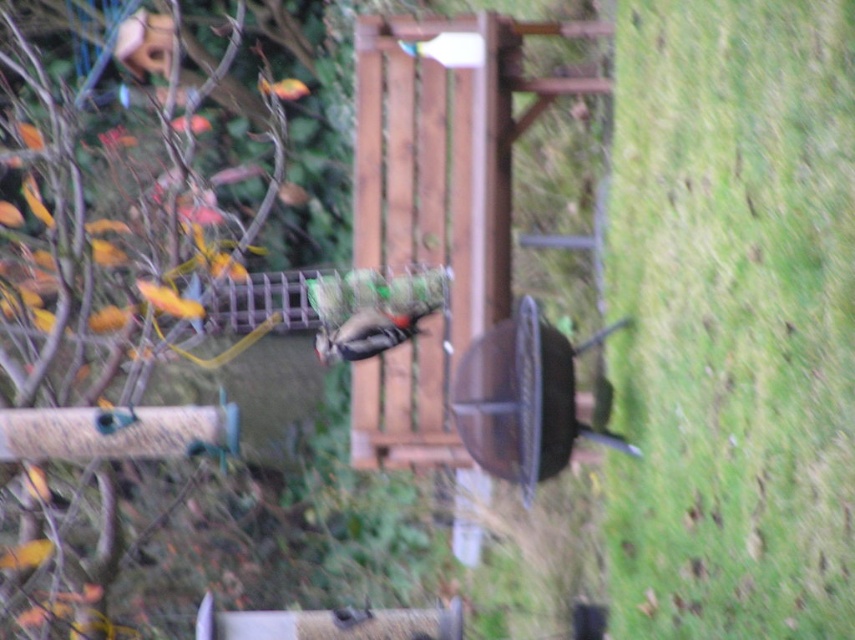
Can you confirm if green grass at lower right is positioned above brown matte woodpecker at center?

Correct, green grass at lower right is located above brown matte woodpecker at center.

Which is more to the left, green grass at lower right or brown matte woodpecker at center?

Positioned to the left is brown matte woodpecker at center.

Identify the location of green grass at lower right. This screenshot has width=855, height=640. (733, 320).

Does green matte bird feeder at left have a lesser height compared to brown matte woodpecker at center?

No.

Does green matte bird feeder at left come in front of brown matte woodpecker at center?

No, green matte bird feeder at left is behind brown matte woodpecker at center.

Does point (97, 630) come behind point (367, 326)?

Yes.

Where is `green matte bird feeder at left`? green matte bird feeder at left is located at coordinates (119, 292).

Can you confirm if green grass at lower right is shorter than green matte bird feeder at left?

Correct, green grass at lower right is not as tall as green matte bird feeder at left.

You are a GUI agent. You are given a task and a screenshot of the screen. Output one action in this format:
    pyautogui.click(x=<x>, y=<y>)
    Task: Click on the green grass at lower right
    Image resolution: width=855 pixels, height=640 pixels.
    Given the screenshot: What is the action you would take?
    pyautogui.click(x=733, y=320)

This screenshot has height=640, width=855. What are the coordinates of `green grass at lower right` in the screenshot? It's located at (733, 320).